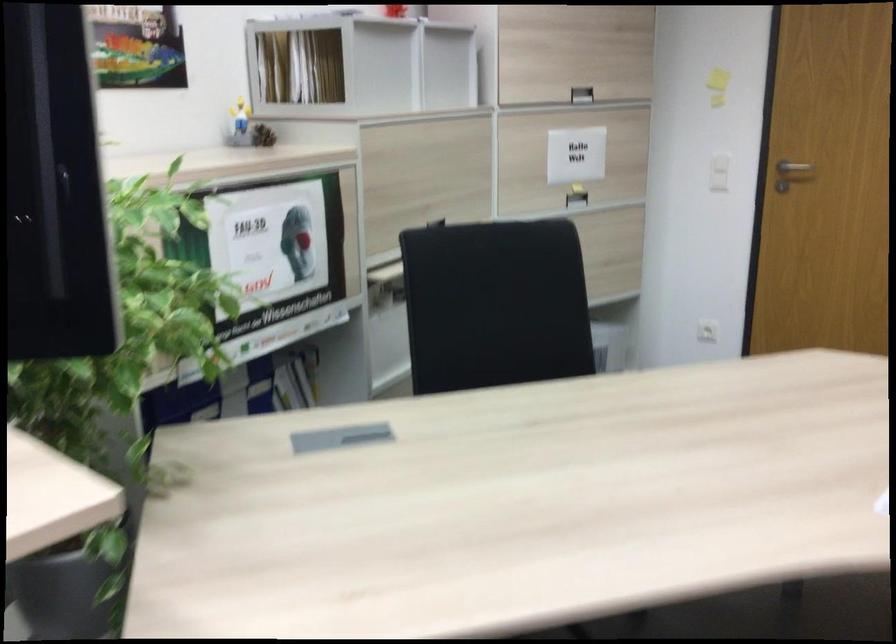
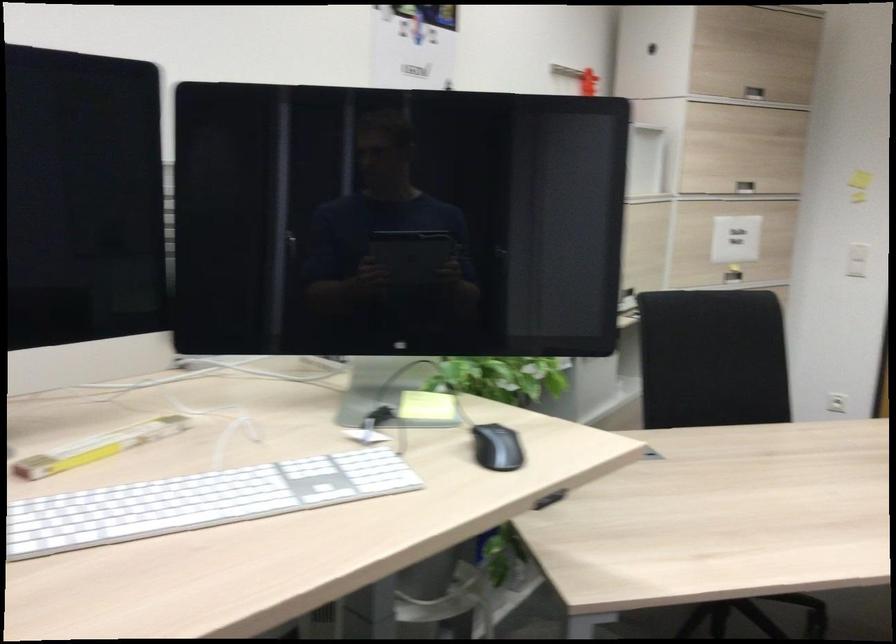
Find the pixel in the second image that matches the point at 565,196 in the first image.

(733, 275)